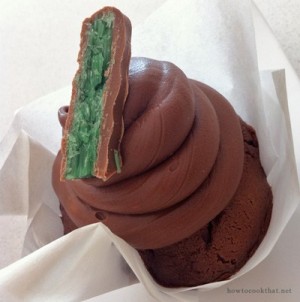
The height and width of the screenshot is (302, 300). I want to click on white table, so click(279, 21).